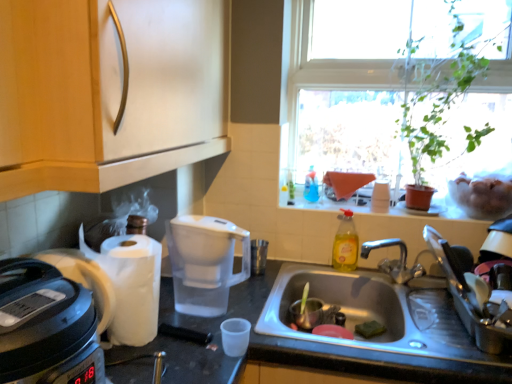
Locate an element on the screen. The image size is (512, 384). transparent glass window at upper right is located at coordinates (347, 89).

Find the location of a particular element. This screenshot has width=512, height=384. stainless steel sink at lower center is located at coordinates (379, 312).

I want to click on metallic sink at lower center, so click(288, 347).

Identify the location of green leafy plant at upper right. (436, 95).

What do you see at coordinates (345, 243) in the screenshot? I see `yellow translucent bottle at sink, the 1th bottle in the bottom-to-top sequence` at bounding box center [345, 243].

What do you see at coordinates (46, 326) in the screenshot? This screenshot has height=384, width=512. I see `white plastic rice cooker at left` at bounding box center [46, 326].

Where is `transparent glass window at upper right`? The width and height of the screenshot is (512, 384). transparent glass window at upper right is located at coordinates (347, 89).

Is translucent plastic bottle at upper right, arranged as the 2th bottle when viewed from the right, taller than metallic sink at lower center?

Incorrect, the height of translucent plastic bottle at upper right, arranged as the 2th bottle when viewed from the right, is not larger of that of metallic sink at lower center.

Which object is closer to the camera, translucent plastic bottle at upper right, the 2th bottle in the front-to-back sequence, or metallic sink at lower center?

metallic sink at lower center is in front.

From the image's perspective, which one is positioned lower, translucent plastic bottle at upper right, which is counted as the 2th bottle, starting from the bottom, or metallic sink at lower center?

metallic sink at lower center is shown below in the image.

Is translucent plastic bottle at upper right, which is the 1th bottle from left to right, not within metallic sink at lower center?

Yes, translucent plastic bottle at upper right, which is the 1th bottle from left to right, is not within metallic sink at lower center.

This screenshot has width=512, height=384. Identify the location of bottle below the translucent plastic bottle at upper right, the 2th bottle in the front-to-back sequence (from a real-world perspective). (345, 243).

How different are the orientations of yellow translucent bottle at sink, the 1th bottle in the bottom-to-top sequence, and translucent plastic bottle at upper right, which is counted as the 2th bottle, starting from the bottom, in degrees?

0.521 degrees separate the facing orientations of yellow translucent bottle at sink, the 1th bottle in the bottom-to-top sequence, and translucent plastic bottle at upper right, which is counted as the 2th bottle, starting from the bottom.

Who is taller, yellow translucent bottle at sink, marked as the 2th bottle in a left-to-right arrangement, or translucent plastic bottle at upper right, positioned as the 1th bottle in top-to-bottom order?

yellow translucent bottle at sink, marked as the 2th bottle in a left-to-right arrangement, is taller.

From the image's perspective, is yellow translucent bottle at sink, the 1th bottle positioned from the right, located above translucent plastic bottle at upper right, which is counted as the 2th bottle, starting from the bottom?

Incorrect, from the image's perspective, yellow translucent bottle at sink, the 1th bottle positioned from the right, is lower than translucent plastic bottle at upper right, which is counted as the 2th bottle, starting from the bottom.

Consider the image. From the image's perspective, which is above, green leafy plant at upper right or transparent plastic water filter at center?

green leafy plant at upper right.

Considering the sizes of objects green leafy plant at upper right and transparent plastic water filter at center in the image provided, who is shorter, green leafy plant at upper right or transparent plastic water filter at center?

transparent plastic water filter at center is shorter.

Which of these two, green leafy plant at upper right or transparent plastic water filter at center, is thinner?

With smaller width is transparent plastic water filter at center.

Is point (458, 54) closer or farther from the camera than point (206, 244)?

Point (458, 54).

In the image, is yellow translucent bottle at sink, marked as the 2th bottle in a left-to-right arrangement, positioned in front of or behind transparent glass window at upper right?

yellow translucent bottle at sink, marked as the 2th bottle in a left-to-right arrangement, is positioned farther from the viewer than transparent glass window at upper right.

Considering the relative sizes of yellow translucent bottle at sink, which ranks as the first bottle in front-to-back order, and transparent glass window at upper right in the image provided, is yellow translucent bottle at sink, which ranks as the first bottle in front-to-back order, thinner than transparent glass window at upper right?

Indeed, yellow translucent bottle at sink, which ranks as the first bottle in front-to-back order, has a lesser width compared to transparent glass window at upper right.

Does point (351, 251) appear closer or farther from the camera than point (373, 163)?

Point (351, 251).

Does yellow translucent bottle at sink, marked as the second bottle in a top-to-bottom arrangement, appear on the left side of transparent glass window at upper right?

Yes, yellow translucent bottle at sink, marked as the second bottle in a top-to-bottom arrangement, is to the left of transparent glass window at upper right.

From a real-world perspective, between metallic sink at lower center and translucent plastic bottle at upper right, which is the 1th bottle from left to right, who is vertically higher?

From a 3D spatial view, translucent plastic bottle at upper right, which is the 1th bottle from left to right, is above.

Can you tell me how much metallic sink at lower center and translucent plastic bottle at upper right, which is the 1th bottle in back-to-front order, differ in facing direction?

The angular difference between metallic sink at lower center and translucent plastic bottle at upper right, which is the 1th bottle in back-to-front order, is 2.44 degrees.

Considering the relative sizes of metallic sink at lower center and translucent plastic bottle at upper right, which is the 1th bottle from left to right, in the image provided, is metallic sink at lower center thinner than translucent plastic bottle at upper right, which is the 1th bottle from left to right,?

In fact, metallic sink at lower center might be wider than translucent plastic bottle at upper right, which is the 1th bottle from left to right.

Could you tell me if metallic sink at lower center is turned towards translucent plastic bottle at upper right, arranged as the 2th bottle when viewed from the right?

No, metallic sink at lower center is not turned towards translucent plastic bottle at upper right, arranged as the 2th bottle when viewed from the right.

How many degrees apart are the facing directions of transparent glass window at upper right and transparent plastic water filter at center?

The angle between the facing direction of transparent glass window at upper right and the facing direction of transparent plastic water filter at center is 35.4 degrees.

Is transparent glass window at upper right positioned with its back to transparent plastic water filter at center?

No.

Can you confirm if transparent glass window at upper right is positioned to the right of transparent plastic water filter at center?

Yes.

Locate an element on the screen. window positioned vertically above the transparent plastic water filter at center (from a real-world perspective) is located at coordinates (347, 89).

Which is more distant, [464,35] or [409,298]?

The point [409,298] is more distant.

Based on the photo, does transparent glass window at upper right have a lesser width compared to stainless steel sink at lower center?

Yes.

Is the position of transparent glass window at upper right more distant than that of stainless steel sink at lower center?

Yes, the depth of transparent glass window at upper right is greater than that of stainless steel sink at lower center.

Looking at this image, which of these two, transparent glass window at upper right or stainless steel sink at lower center, is bigger?

transparent glass window at upper right is bigger.

From a real-world perspective, starting from the metallic sink at lower center, which bottle is the 2nd one vertically above it? Please provide its 2D coordinates.

[(311, 186)]

What are the coordinates of `bottle below the translucent plastic bottle at upper right, arranged as the 2th bottle when viewed from the right (from a real-world perspective)` in the screenshot? It's located at tap(345, 243).

When comparing their distances from wooden cabinet at upper left, does translucent plastic bottle at upper right, which is the 1th bottle from left to right, or yellow translucent bottle at sink, marked as the second bottle in a top-to-bottom arrangement, seem closer?

Based on the image, yellow translucent bottle at sink, marked as the second bottle in a top-to-bottom arrangement, appears to be nearer to wooden cabinet at upper left.

Which object lies further to the anchor point yellow translucent bottle at sink, which ranks as the first bottle in front-to-back order, transparent glass window at upper right or white plastic rice cooker at left?

Based on the image, white plastic rice cooker at left appears to be further to yellow translucent bottle at sink, which ranks as the first bottle in front-to-back order.

Looking at the image, which one is located closer to green leafy plant at upper right, wooden cabinet at upper left or white plastic rice cooker at left?

wooden cabinet at upper left lies closer to green leafy plant at upper right than the other object.

When comparing their distances from stainless steel sink at lower center, does yellow translucent bottle at sink, placed as the second bottle when sorted from back to front, or white plastic rice cooker at left seem closer?

Among the two, yellow translucent bottle at sink, placed as the second bottle when sorted from back to front, is located nearer to stainless steel sink at lower center.

Looking at the image, which one is located closer to transparent plastic water filter at center, transparent glass window at upper right or white plastic rice cooker at left?

The object closer to transparent plastic water filter at center is white plastic rice cooker at left.

Which object lies further to the anchor point green leafy plant at upper right, transparent glass window at upper right or stainless steel sink at lower center?

The object further to green leafy plant at upper right is stainless steel sink at lower center.

Looking at the image, which one is located further to transparent glass window at upper right, stainless steel sink at lower center or transparent plastic water filter at center?

The object further to transparent glass window at upper right is transparent plastic water filter at center.

Estimate the real-world distances between objects in this image. Which object is further from translucent plastic bottle at upper right, the 2th bottle in the front-to-back sequence, yellow translucent bottle at sink, placed as the second bottle when sorted from back to front, or metallic sink at lower center?

metallic sink at lower center is positioned further to the anchor translucent plastic bottle at upper right, the 2th bottle in the front-to-back sequence.

You are a GUI agent. You are given a task and a screenshot of the screen. Output one action in this format:
    pyautogui.click(x=<x>, y=<y>)
    Task: Click on the coffeepot located between white plastic rice cooker at left and stainless steel sink at lower center in the left-right direction
    This screenshot has width=512, height=384.
    Given the screenshot: What is the action you would take?
    pyautogui.click(x=205, y=263)

Where is `coffeepot between green leafy plant at upper right and metallic sink at lower center vertically`? The height and width of the screenshot is (384, 512). coffeepot between green leafy plant at upper right and metallic sink at lower center vertically is located at coordinates (205, 263).

Where is `cabinetry between white plastic rice cooker at left and stainless steel sink at lower center in the horizontal direction`? This screenshot has height=384, width=512. cabinetry between white plastic rice cooker at left and stainless steel sink at lower center in the horizontal direction is located at coordinates (109, 91).

Find the location of a particular element. window between white plastic rice cooker at left and translucent plastic bottle at upper right, which is counted as the 2th bottle, starting from the bottom, in the front-back direction is located at coordinates (347, 89).